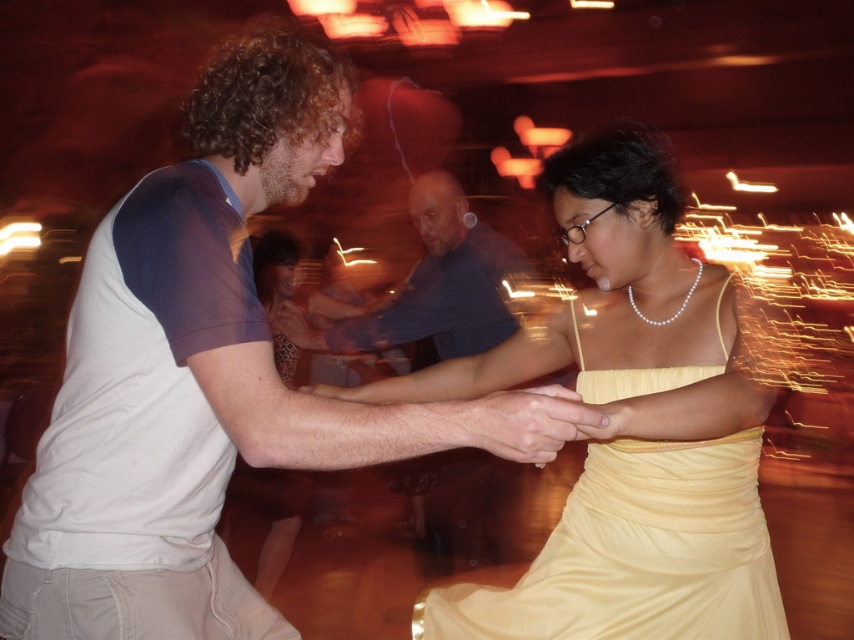
Is white cotton shirt at center positioned at the back of smooth skin hand at center?

That is False.

Between point (282, 68) and point (545, 451), which one is positioned in front?

Point (545, 451) is more forward.

Where is `white cotton shirt at center`? The image size is (854, 640). white cotton shirt at center is located at coordinates (190, 371).

Describe the element at coordinates (431, 285) in the screenshot. I see `blue cotton shirt at center` at that location.

Is blue cotton shirt at center bigger than smooth skin hand at center?

Yes.

Identify the location of blue cotton shirt at center. (431, 285).

Find the location of a particular element. Image resolution: width=854 pixels, height=640 pixels. blue cotton shirt at center is located at coordinates (431, 285).

Is yellow satin dress at center to the left of blue cotton shirt at center from the viewer's perspective?

No, yellow satin dress at center is not to the left of blue cotton shirt at center.

Can you confirm if yellow satin dress at center is wider than blue cotton shirt at center?

Incorrect, yellow satin dress at center's width does not surpass blue cotton shirt at center's.

Which is behind, point (594, 612) or point (468, 288)?

Point (468, 288)

I want to click on yellow satin dress at center, so click(x=636, y=554).